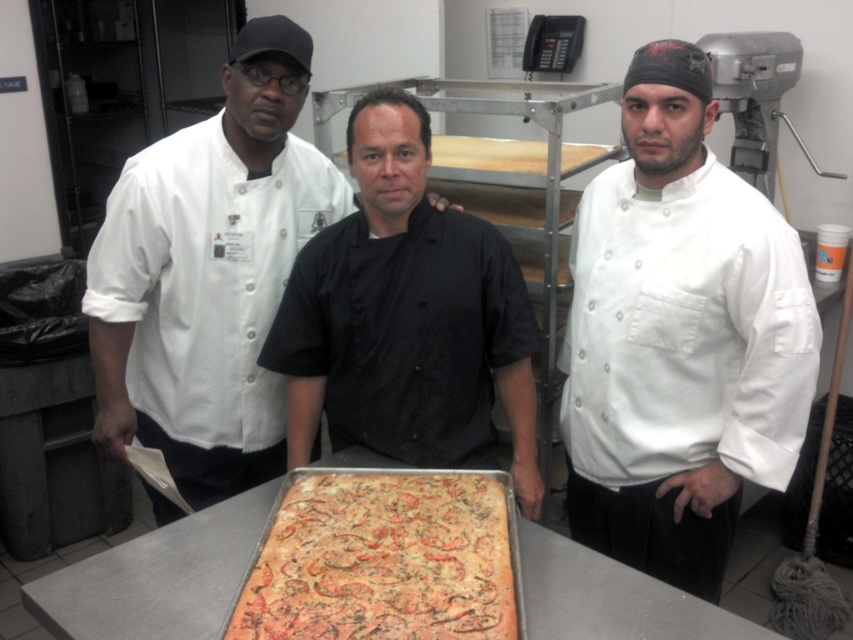
Which is in front, point (376, 353) or point (416, 604)?

Point (416, 604)

Can you confirm if black matte chef coat at center is positioned below golden-brown crusty pizza at center?

Incorrect, black matte chef coat at center is not positioned below golden-brown crusty pizza at center.

This screenshot has height=640, width=853. What are the coordinates of `black matte chef coat at center` in the screenshot? It's located at (405, 317).

The width and height of the screenshot is (853, 640). I want to click on black matte chef coat at center, so click(x=405, y=317).

Does white matte chef coat at center have a greater height compared to black matte chef coat at center?

Yes, white matte chef coat at center is taller than black matte chef coat at center.

Does white matte chef coat at center have a larger size compared to black matte chef coat at center?

Yes.

Identify the location of white matte chef coat at center. The height and width of the screenshot is (640, 853). (679, 337).

Does white matte chef coat at center lie behind white matte chef coat at left?

No.

Find the location of `white matte chef coat at center`. white matte chef coat at center is located at coordinates (679, 337).